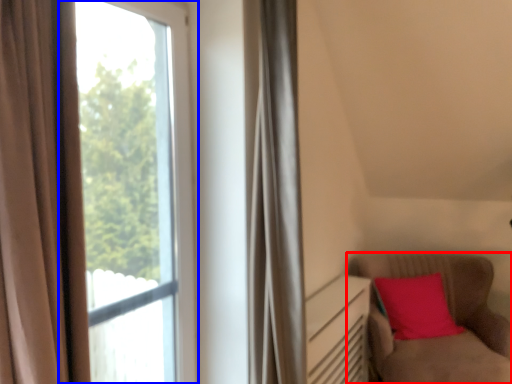
Question: Among these objects, which one is nearest to the camera, furniture (highlighted by a red box) or window (highlighted by a blue box)?

Choices:
 (A) furniture
 (B) window

Answer: (B)